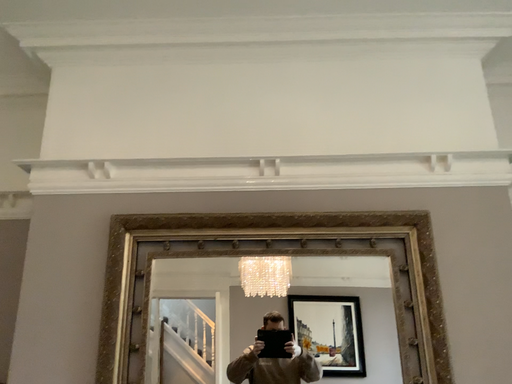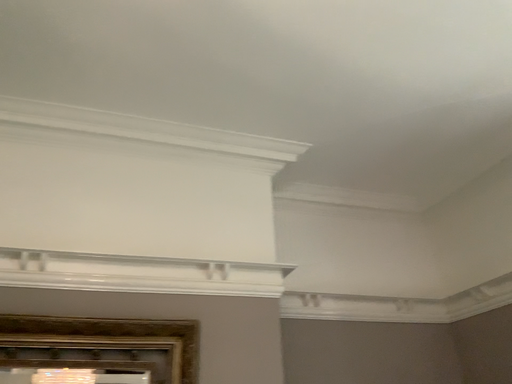
Question: How did the camera likely rotate when shooting the video?

Choices:
 (A) rotated downward
 (B) rotated upward

Answer: (B)